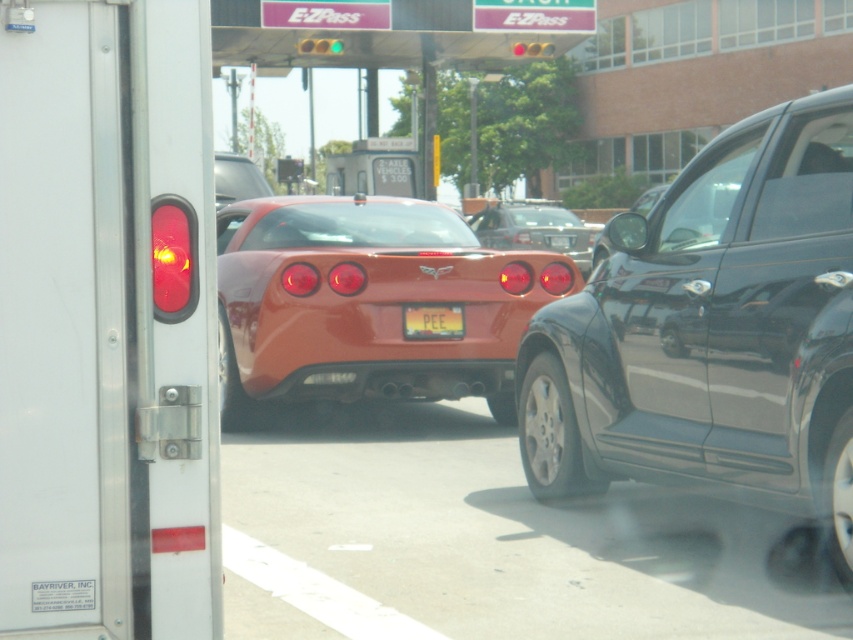
Who is more distant from viewer, (654, 202) or (541, 49)?

The point (541, 49) is behind.

Measure the distance from glossy black car at center to red glass traffic light at center.

4.67 meters

Is point (653, 193) closer to viewer compared to point (519, 54)?

No, it is not.

You are a GUI agent. You are given a task and a screenshot of the screen. Output one action in this format:
    pyautogui.click(x=<x>, y=<y>)
    Task: Click on the glossy black car at center
    The width and height of the screenshot is (853, 640).
    Given the screenshot: What is the action you would take?
    pyautogui.click(x=648, y=198)

Consider the image. Does glossy orange car at center have a lesser height compared to shiny orange car at center?

No, glossy orange car at center is not shorter than shiny orange car at center.

Looking at this image, between glossy orange car at center and shiny orange car at center, which one has more height?

glossy orange car at center is taller.

Does point (532, 248) come behind point (236, 170)?

Yes, point (532, 248) is behind point (236, 170).

Where is `glossy orange car at center`? glossy orange car at center is located at coordinates (534, 228).

Is glossy black car at center shorter than green glass traffic light at upper center?

No, glossy black car at center is not shorter than green glass traffic light at upper center.

Which is more to the right, glossy black car at center or green glass traffic light at upper center?

glossy black car at center

At what (x,y) coordinates should I click in order to perform the action: click on glossy black car at center. Please return your answer as a coordinate pair (x, y). The width and height of the screenshot is (853, 640). Looking at the image, I should click on (648, 198).